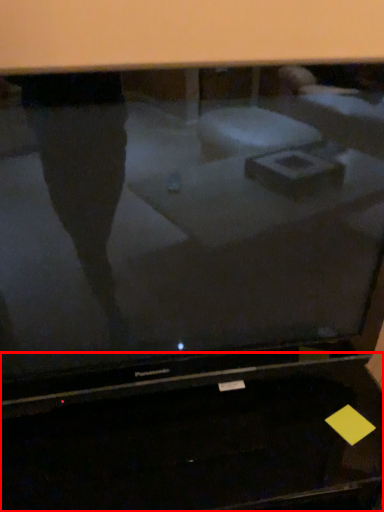
Question: In this image, where is desktop (annotated by the red box) located relative to television?

Choices:
 (A) right
 (B) left

Answer: (B)